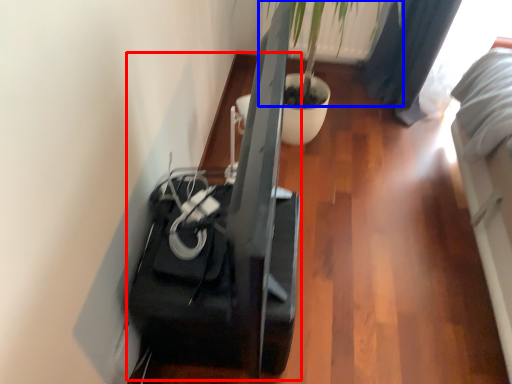
Question: Which object appears closest to the camera in this image, furniture (highlighted by a red box) or plant (highlighted by a blue box)?

Choices:
 (A) furniture
 (B) plant

Answer: (A)